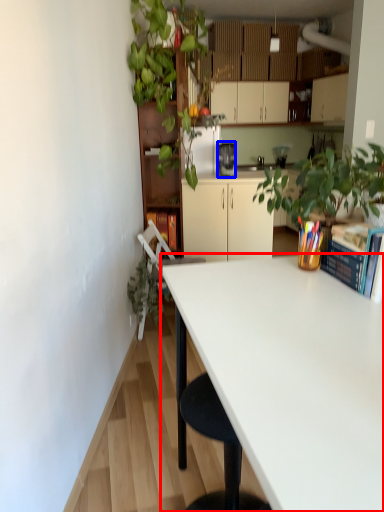
Question: Which point is closer to the camera, desk (highlighted by a red box) or coffee maker (highlighted by a blue box)?

Choices:
 (A) desk
 (B) coffee maker

Answer: (A)